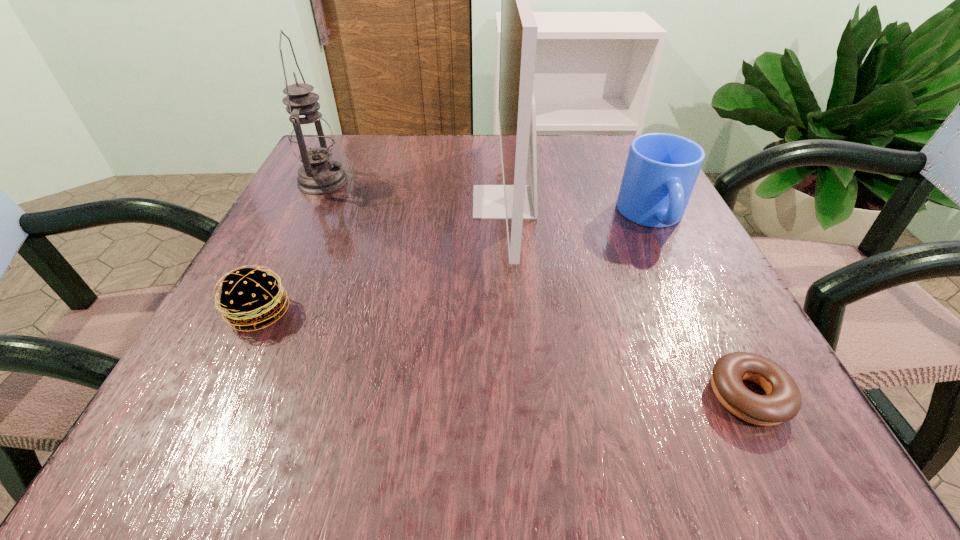
Select which object is the fourth closest to the oil lamp. Please provide its 2D coordinates. Your answer should be formatted as a tuple, i.e. [(x, y)], where the tuple contains the x and y coordinates of a point satisfying the conditions above.

[(783, 401)]

Find the location of a particular element. Image resolution: width=960 pixels, height=540 pixels. free location that satisfies the following two spatial constraints: 1. on the back side of the shortest object; 2. on the front-facing side of the tallest object is located at coordinates (650, 202).

Identify the location of free spot that satisfies the following two spatial constraints: 1. on the front-facing side of the nearest object; 2. on the left side of the tallest object. The height and width of the screenshot is (540, 960). (518, 396).

This screenshot has height=540, width=960. Find the location of `free location that satisfies the following two spatial constraints: 1. on the front side of the shortest object; 2. on the left side of the second shortest object`. free location that satisfies the following two spatial constraints: 1. on the front side of the shortest object; 2. on the left side of the second shortest object is located at coordinates (218, 396).

What are the coordinates of `vacant area that satisfies the following two spatial constraints: 1. on the side of the shortest object with the handle; 2. on the left side of the mug` in the screenshot? It's located at (741, 396).